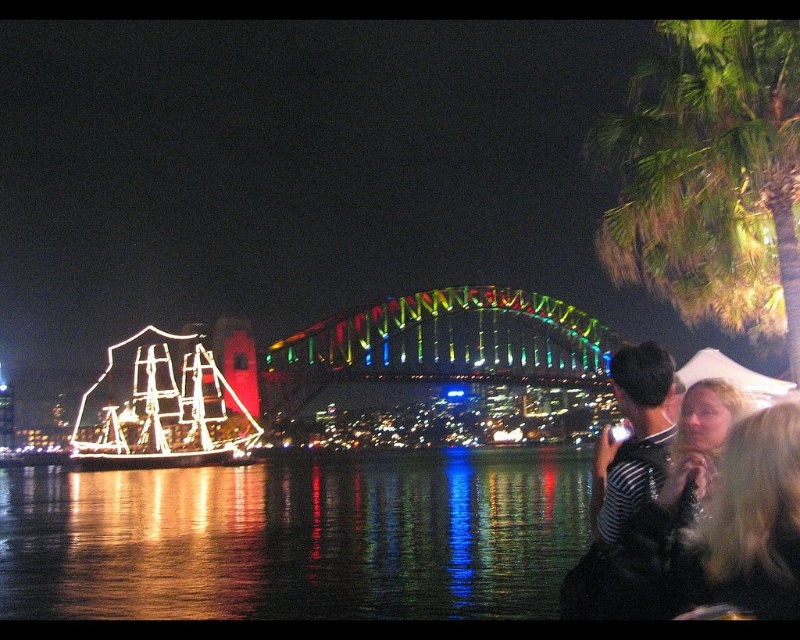
You are a GUI agent. You are given a task and a screenshot of the screen. Output one action in this format:
    pyautogui.click(x=<x>, y=<y>)
    Task: Click on the striped fabric couple at right
    
    Given the screenshot: What is the action you would take?
    pyautogui.click(x=700, y=516)

Does point (634, 580) come closer to viewer compared to point (792, 428)?

No.

Between point (598, 604) and point (728, 584), which one is positioned in front?

Point (728, 584) is in front.

Find the location of a particular element. This screenshot has height=640, width=800. striped fabric couple at right is located at coordinates point(700,516).

Who is lower down, glossy reflective water at center or striped fabric couple at right?

glossy reflective water at center

Is glossy reflective water at center thinner than striped fabric couple at right?

No, glossy reflective water at center is not thinner than striped fabric couple at right.

The height and width of the screenshot is (640, 800). What do you see at coordinates (296, 540) in the screenshot?
I see `glossy reflective water at center` at bounding box center [296, 540].

You are a GUI agent. You are given a task and a screenshot of the screen. Output one action in this format:
    pyautogui.click(x=<x>, y=<y>)
    Task: Click on the glossy reflective water at center
    The image size is (800, 640).
    Given the screenshot: What is the action you would take?
    pyautogui.click(x=296, y=540)

Between point (682, 228) and point (732, 582), which one is positioned behind?

The point (682, 228) is more distant.

Which is more to the left, green leafy palm tree at upper right or blonde hair at lower right?

From the viewer's perspective, blonde hair at lower right appears more on the left side.

Is point (700, 316) closer to camera compared to point (716, 563)?

No, it is behind (716, 563).

In order to click on green leafy palm tree at upper right in this screenshot , I will do 712,177.